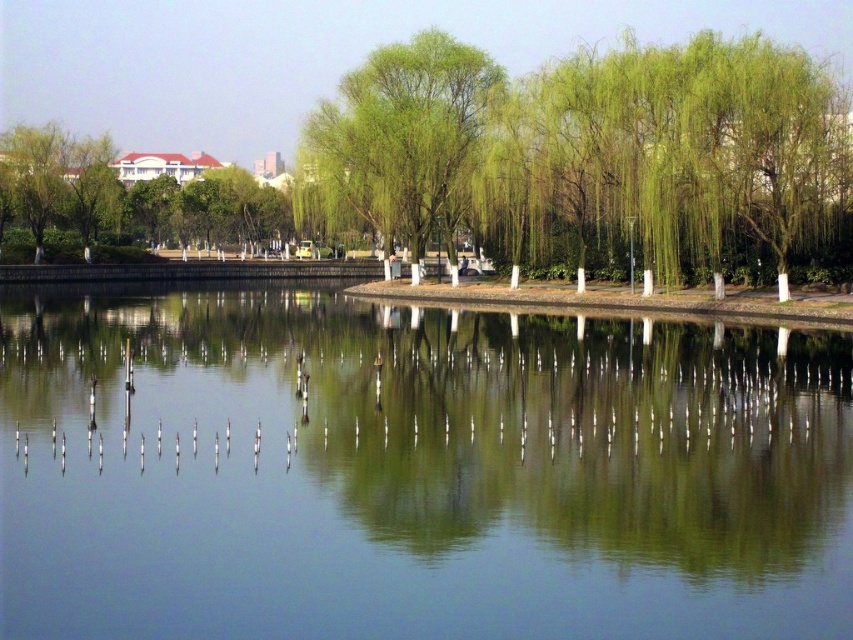
Question: From the image, what is the correct spatial relationship of clear water at center in relation to green leafy tree at upper left?

Choices:
 (A) above
 (B) below

Answer: (B)

Question: Is green leafy willow at center positioned at the back of green leafy tree at upper left?

Choices:
 (A) no
 (B) yes

Answer: (A)

Question: Among these objects, which one is farthest from the camera?

Choices:
 (A) green leafy willow at center
 (B) clear water at center

Answer: (A)

Question: Does clear water at center appear on the right side of green leafy willow at center?

Choices:
 (A) yes
 (B) no

Answer: (A)

Question: Which object is positioned farthest from the clear water at center?

Choices:
 (A) green leafy tree at upper left
 (B) green leafy willow at center

Answer: (A)

Question: Which point appears closest to the camera in this image?

Choices:
 (A) (103, 198)
 (B) (328, 419)

Answer: (B)